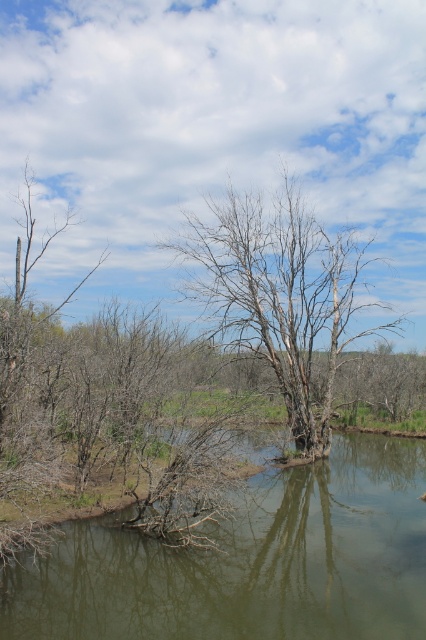
What do you see at coordinates (249, 563) in the screenshot? I see `green murky water at center` at bounding box center [249, 563].

Identify the location of green murky water at center. The image size is (426, 640). (249, 563).